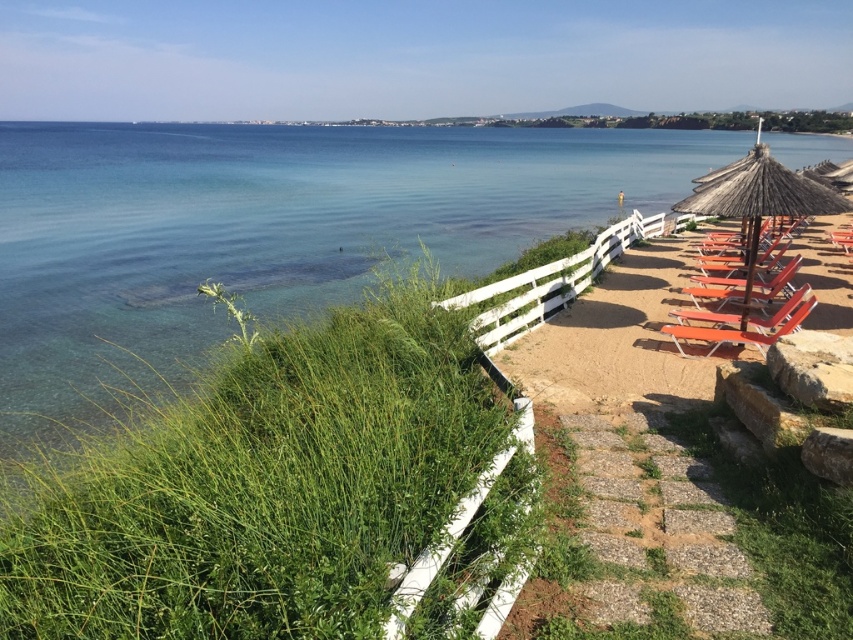
You are a visitor at the beach and want to know if you can stand under the thatched straw umbrella at right while sitting on the matte orange beach chair at right. Can you do that?

The thatched straw umbrella at right is taller than the matte orange beach chair at right, so yes, you can stand under the thatched straw umbrella at right while sitting on the matte orange beach chair at right because the umbrella provides enough vertical space.

You are a beachgoer who wants to move from the pathway to the beach. You see the thatched straw umbrella at right and the matte orange beach chair at right. Which object should you go around to reach the beach without crossing between them?

You should go around the thatched straw umbrella at right because it is in front of the matte orange beach chair at right, so moving around the umbrella would allow you to reach the beach without crossing between them.